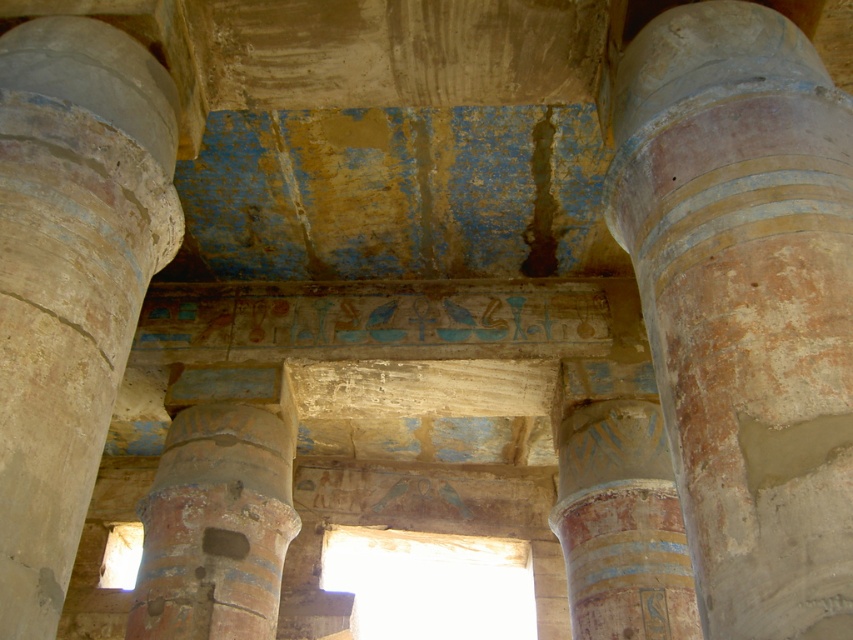
Based on the photo, you are an archaeologist examining the ancient Egyptian temple. You notice two columns, the smooth stone column at left and the rusty stone column at center. Which column is wider?

The rusty stone column at center is wider than the smooth stone column at left.

Consider the image. You are an archaeologist examining the ancient Egyptian temple interior. You notice a point at coordinates [70,280]. What object does this coordinate correspond to?

The point at coordinates [70,280] corresponds to the smooth stone column at left.